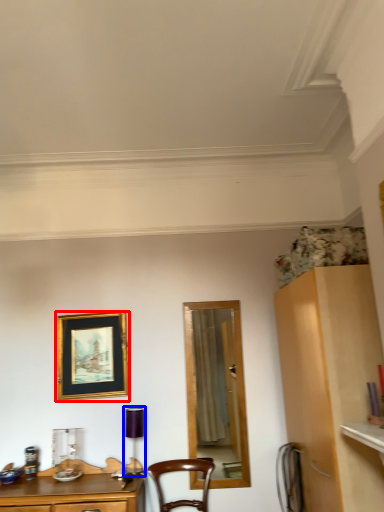
Question: Which point is further to the camera, picture frame (highlighted by a red box) or lamp (highlighted by a blue box)?

Choices:
 (A) picture frame
 (B) lamp

Answer: (A)